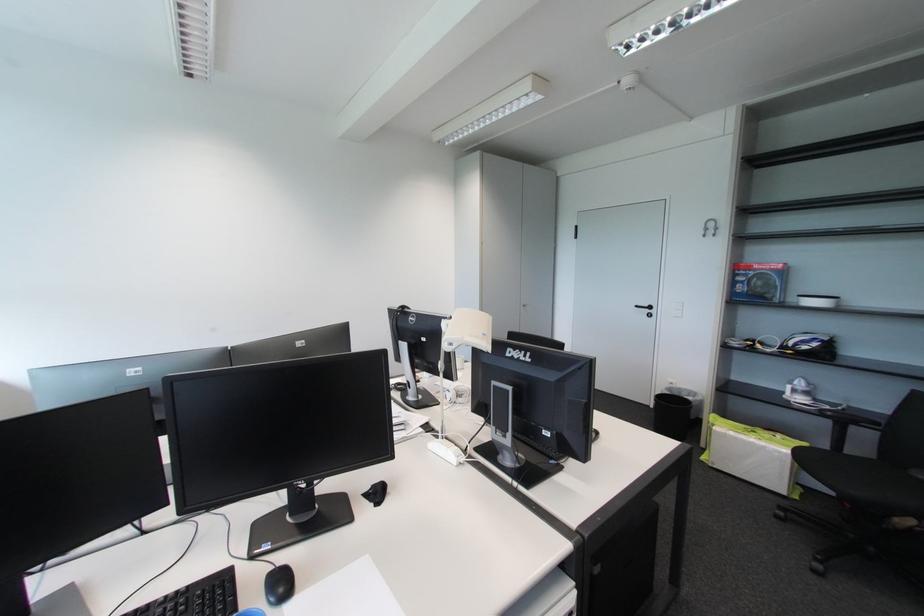
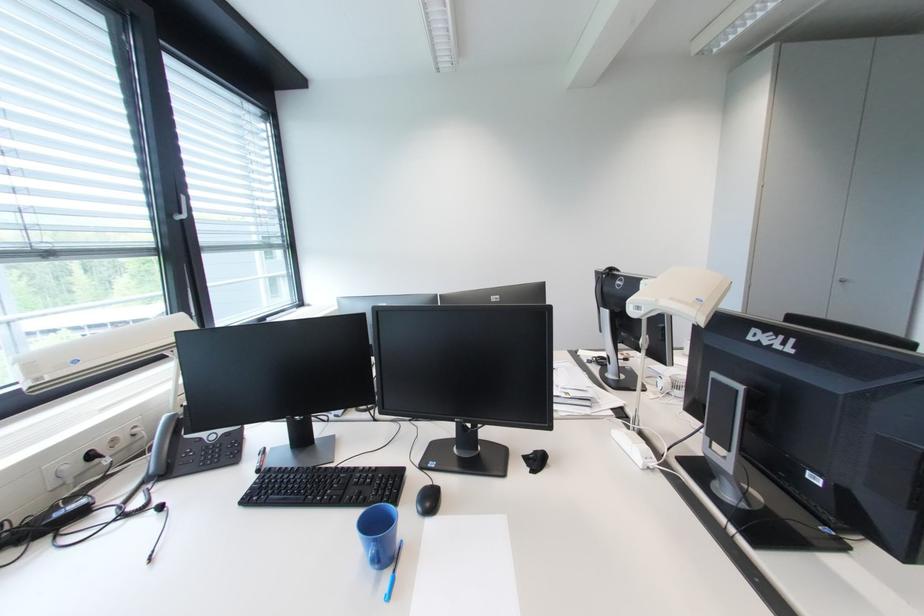
Where in the second image is the point corresponding to the point at 379,488 from the first image?

(541, 454)